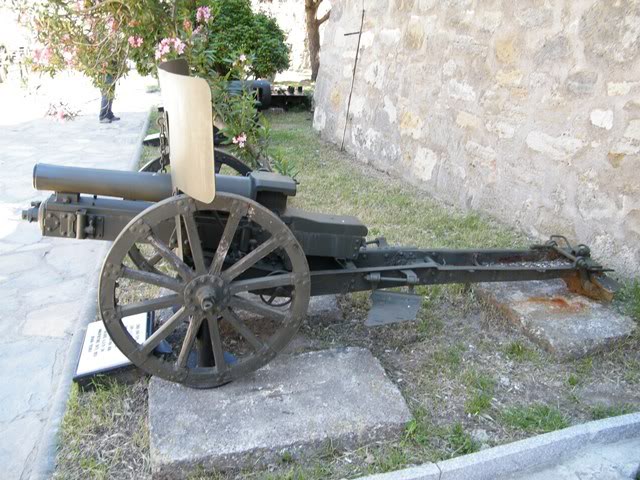
This screenshot has height=480, width=640. I want to click on plaques, so click(x=89, y=352), click(x=150, y=136).